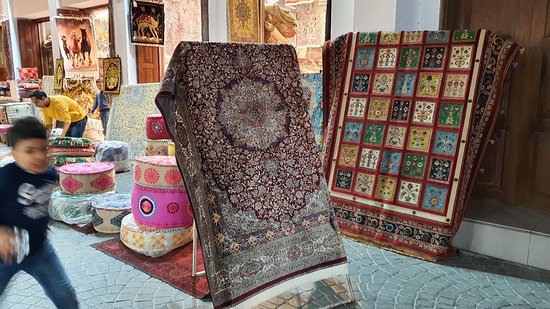
Locate an element on the screen. The image size is (550, 309). decorative rugs is located at coordinates (249, 199), (384, 98), (126, 103).